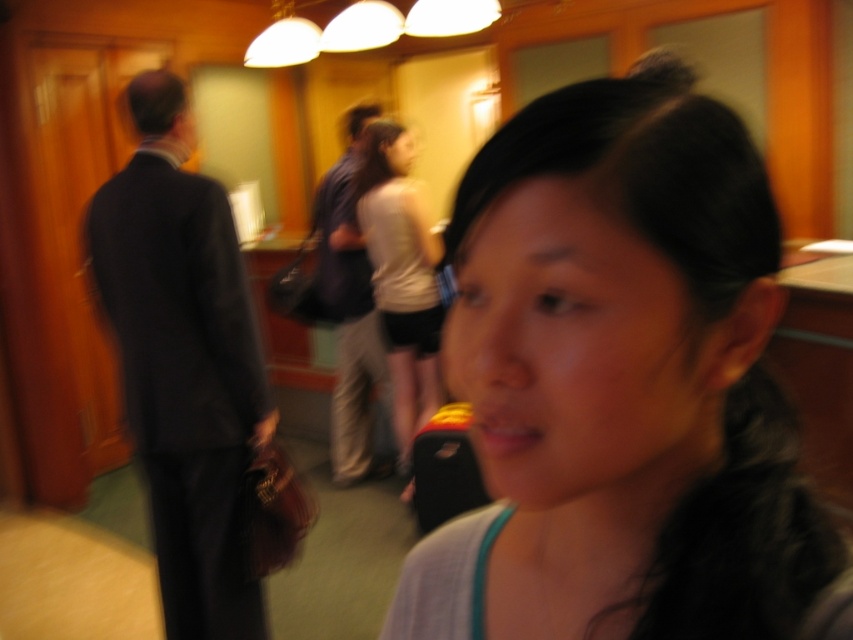
Who is positioned more to the right, white matte shirt at center or dark blue suit at center?

white matte shirt at center

Is white matte shirt at center closer to camera compared to dark blue suit at center?

Yes, white matte shirt at center is in front of dark blue suit at center.

Does point (374, 145) come farther from viewer compared to point (349, 301)?

No, (374, 145) is in front of (349, 301).

The height and width of the screenshot is (640, 853). Identify the location of white matte shirt at center. (401, 273).

Can you confirm if dark blue suit at left is wider than white matte shirt at center?

Indeed, dark blue suit at left has a greater width compared to white matte shirt at center.

Does dark blue suit at left have a larger size compared to white matte shirt at center?

Actually, dark blue suit at left might be smaller than white matte shirt at center.

Is point (199, 438) behind point (344, 230)?

No, (199, 438) is in front of (344, 230).

Where is `dark blue suit at left`? Image resolution: width=853 pixels, height=640 pixels. dark blue suit at left is located at coordinates (183, 362).

Which is behind, point (561, 202) or point (180, 198)?

The point (180, 198) is behind.

Which is in front, point (550, 300) or point (229, 483)?

Point (550, 300)

At what (x,y) coordinates should I click in order to perform the action: click on smooth skin face at center. Please return your answer as a coordinate pair (x, y). Looking at the image, I should click on (624, 381).